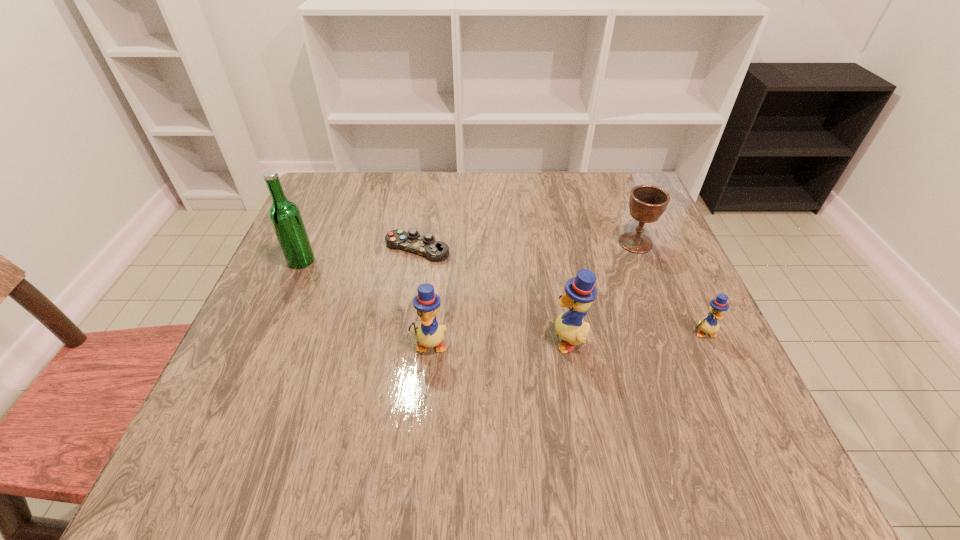
This screenshot has height=540, width=960. Identify the location of vacant spot to place a duckling on the left. (288, 351).